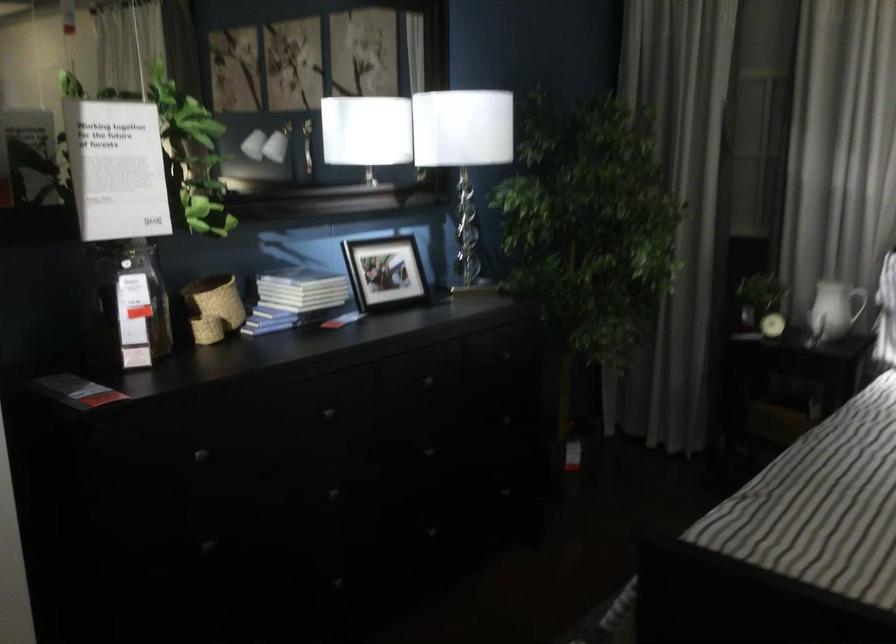
Identify the location of black picture frame. Image resolution: width=896 pixels, height=644 pixels. (384, 272).